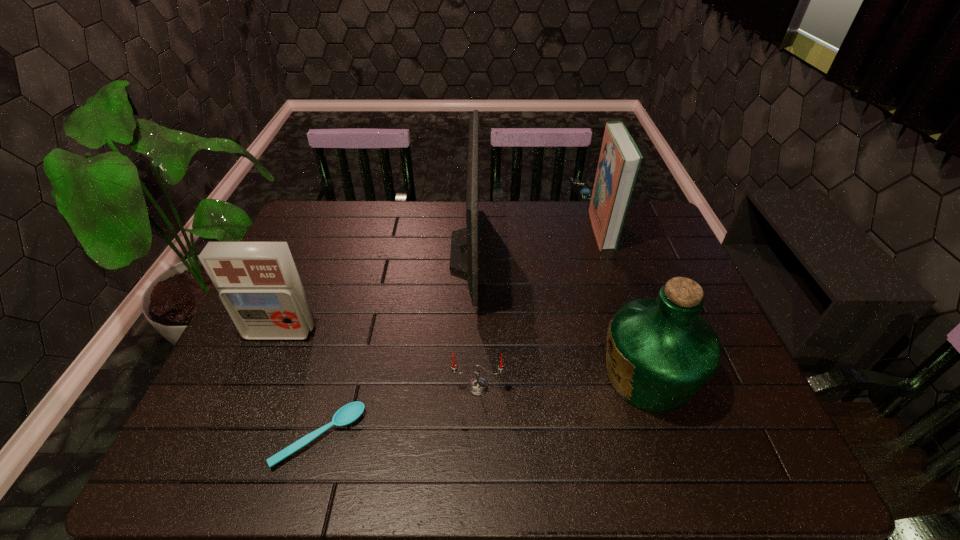
Where is `vacant region between the candle and the monitor`? vacant region between the candle and the monitor is located at coordinates pyautogui.click(x=473, y=320).

Find the location of a particular element. The image size is (960, 540). free space between the monitor and the fifth tallest object is located at coordinates (473, 320).

You are a GUI agent. You are given a task and a screenshot of the screen. Output one action in this format:
    pyautogui.click(x=<x>, y=<y>)
    Task: Click on the unoccupied position between the spoon and the liquor
    
    Given the screenshot: What is the action you would take?
    pyautogui.click(x=484, y=407)

Where is `free space between the spoon and the liquor`? The image size is (960, 540). free space between the spoon and the liquor is located at coordinates (484, 407).

Where is `free spot between the liquor and the shortest object`? free spot between the liquor and the shortest object is located at coordinates (484, 407).

Locate an element on the screen. This screenshot has height=540, width=960. vacant area that lies between the monitor and the hardback book is located at coordinates (535, 241).

At what (x,y) coordinates should I click in order to perform the action: click on vacant area that lies between the liquor and the shortest object. Please return your answer as a coordinate pair (x, y). Looking at the image, I should click on (484, 407).

I want to click on vacant area between the spoon and the monitor, so click(x=394, y=345).

Identify the location of vacant area that lies between the second object from left to right and the hardback book. The height and width of the screenshot is (540, 960). (461, 333).

At what (x,y) coordinates should I click in order to perform the action: click on object that stands as the fifth closest to the first-aid kit. Please return your answer as a coordinate pair (x, y). The width and height of the screenshot is (960, 540). Looking at the image, I should click on 620,159.